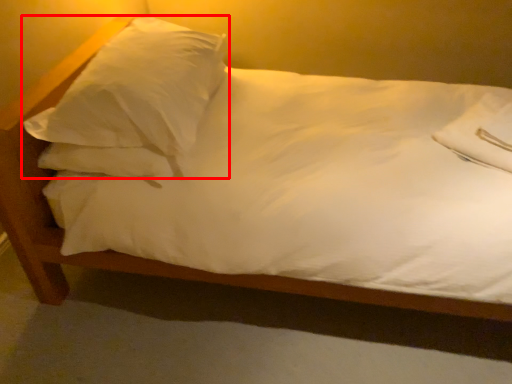
Question: From the image's perspective, what is the correct spatial positioning of pillow (annotated by the red box) in reference to pillow?

Choices:
 (A) below
 (B) above

Answer: (B)